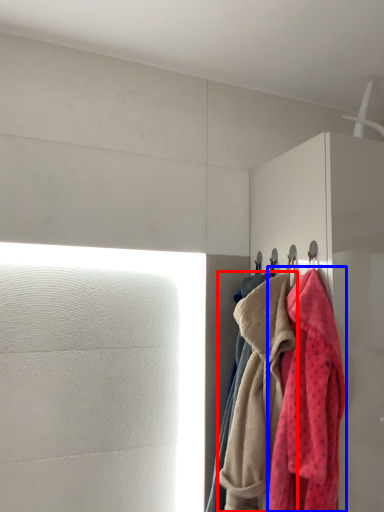
Question: Which of the following is the farthest to the observer, towel (highlighted by a red box) or towel (highlighted by a blue box)?

Choices:
 (A) towel
 (B) towel

Answer: (A)